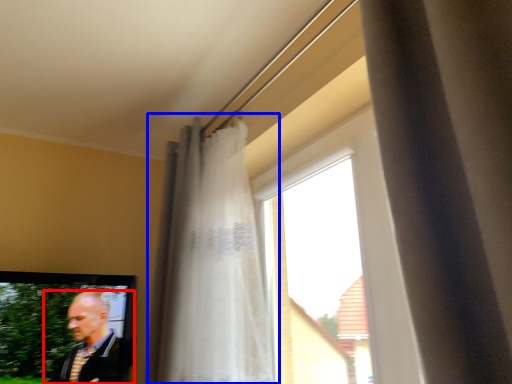
Question: Among these objects, which one is farthest to the camera, man (highlighted by a red box) or curtain (highlighted by a blue box)?

Choices:
 (A) man
 (B) curtain

Answer: (A)